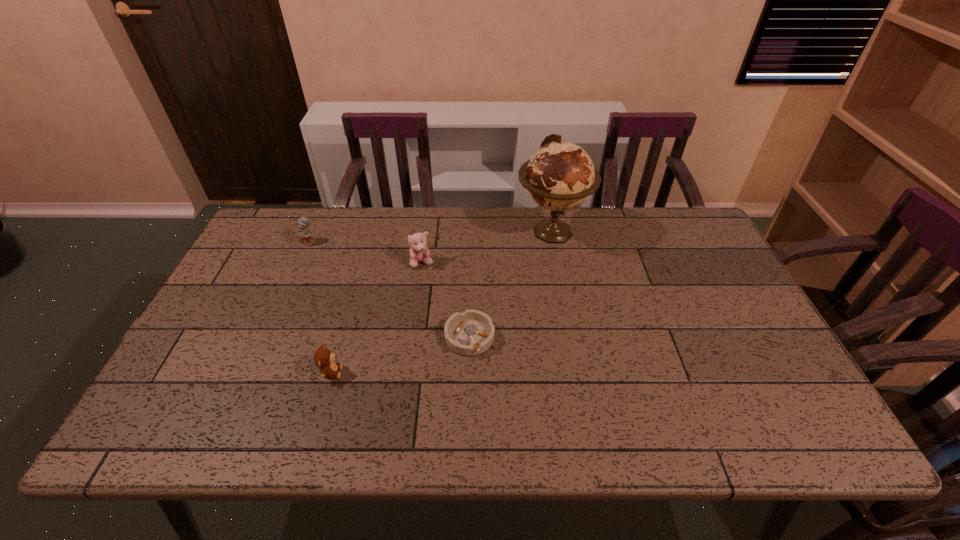
Find the location of `globe`. globe is located at coordinates click(560, 175).

Identify the location of the rightmost object. The image size is (960, 540). (560, 175).

This screenshot has height=540, width=960. In order to click on the fourth shortest object in this screenshot , I will do `click(419, 252)`.

I want to click on the rightmost teddy bear, so click(x=419, y=252).

The width and height of the screenshot is (960, 540). Find the location of `the leftmost teddy bear`. the leftmost teddy bear is located at coordinates (305, 235).

This screenshot has width=960, height=540. What are the coordinates of `the leftmost object` in the screenshot? It's located at (305, 235).

Identify the location of the nearest teddy bear. (324, 359).

You are a GUI agent. You are given a task and a screenshot of the screen. Output one action in this format:
    pyautogui.click(x=<x>, y=<y>)
    Task: Click on the nearest object
    The height and width of the screenshot is (540, 960).
    Given the screenshot: What is the action you would take?
    pyautogui.click(x=324, y=359)

This screenshot has height=540, width=960. Find the location of `the second object from right to left`. the second object from right to left is located at coordinates (472, 332).

Locate an element on the screen. the shortest object is located at coordinates (472, 332).